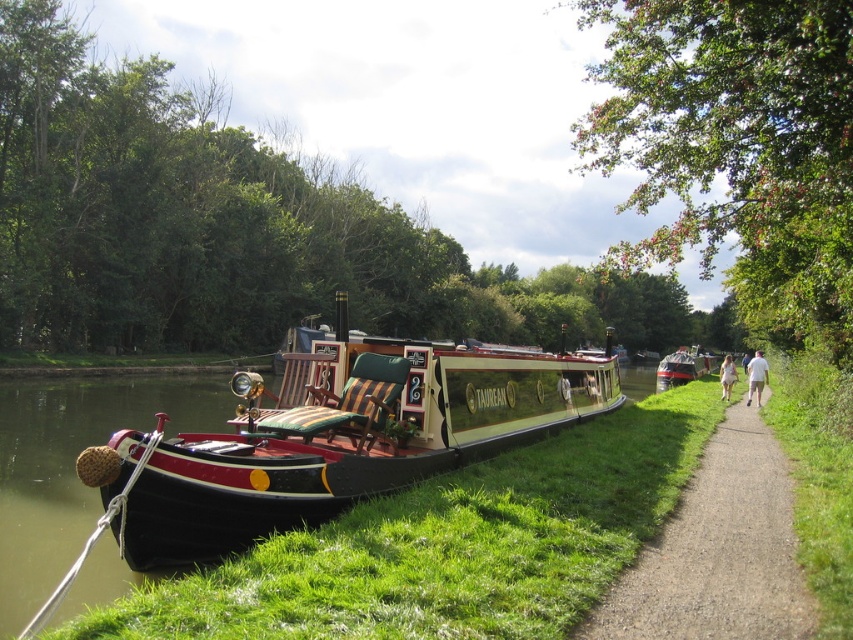
Can you confirm if green polished wood boat at right is positioned to the right of white cotton dress at right?

Correct, you'll find green polished wood boat at right to the right of white cotton dress at right.

Is green polished wood boat at right wider than white cotton dress at right?

Yes.

What do you see at coordinates (682, 369) in the screenshot? I see `green polished wood boat at right` at bounding box center [682, 369].

Find the location of `green polished wood boat at right`. green polished wood boat at right is located at coordinates (682, 369).

Is point (361, 620) positioned before point (704, 365)?

Yes, it is in front of point (704, 365).

Can you confirm if green grass at lower center is shorter than green polished wood boat at right?

Yes.

At what (x,y) coordinates should I click in order to perform the action: click on green grass at lower center. Please return your answer as a coordinate pair (x, y). Looking at the image, I should click on (447, 545).

Can you confirm if polished wood boat at center is positioned to the left of white cotton dress at right?

Correct, you'll find polished wood boat at center to the left of white cotton dress at right.

Is polished wood boat at center thinner than white cotton dress at right?

In fact, polished wood boat at center might be wider than white cotton dress at right.

Locate an element on the screen. This screenshot has width=853, height=640. polished wood boat at center is located at coordinates (335, 438).